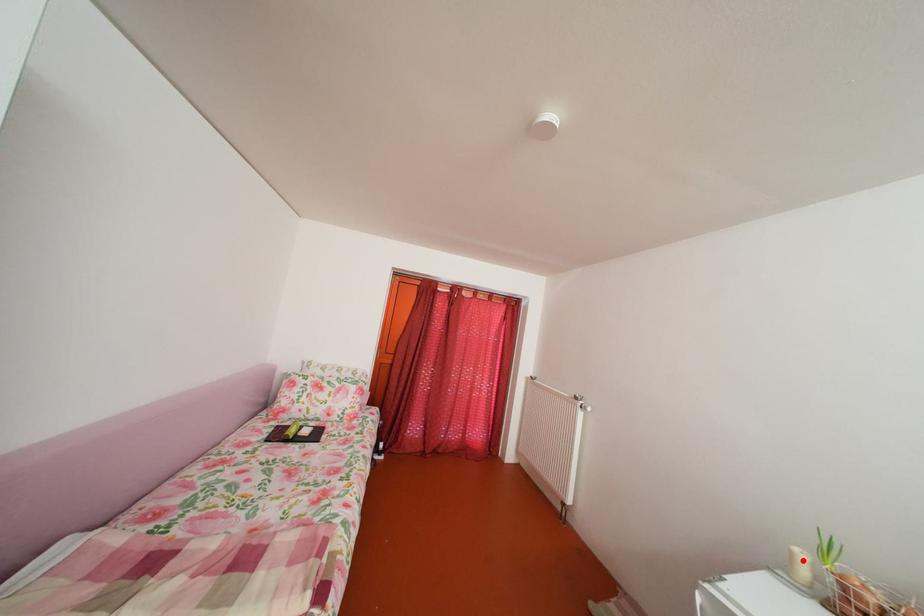
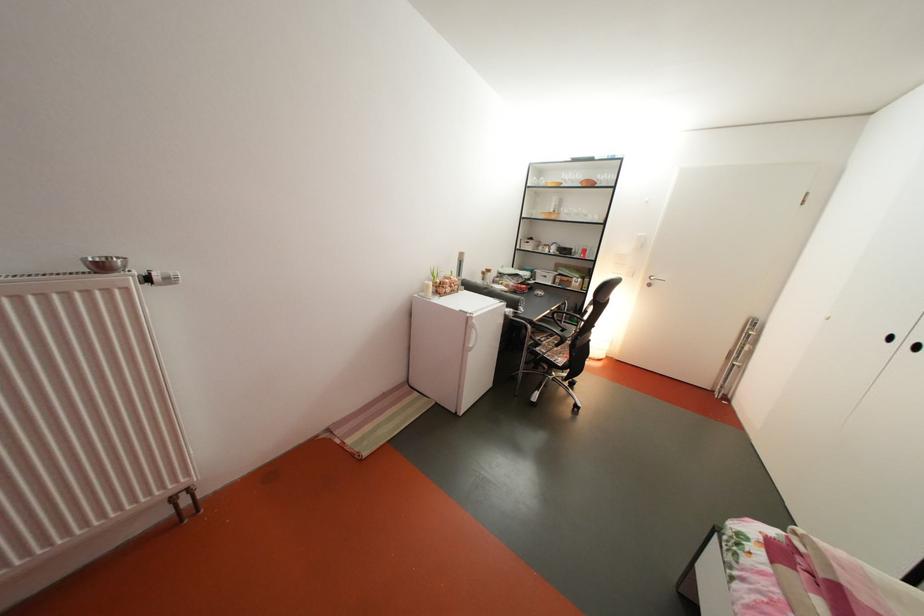
Find the pixel in the second image that matches the highlighted location in the first image.

(439, 293)